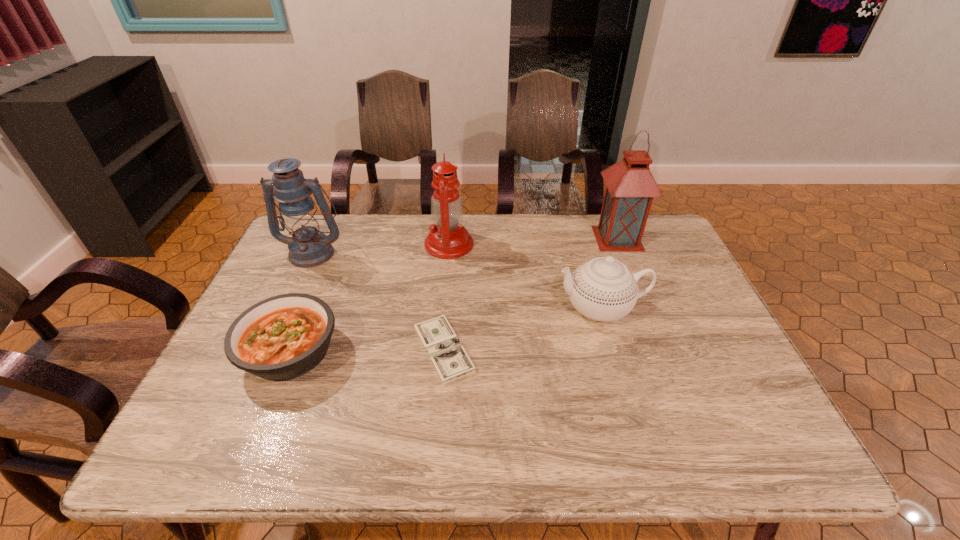
You are a GUI agent. You are given a task and a screenshot of the screen. Output one action in this format:
    pyautogui.click(x=<x>, y=<y>)
    Task: Click on the free space between the left lantern and the oil lamp
    
    Given the screenshot: What is the action you would take?
    pyautogui.click(x=381, y=248)

You are a GUI agent. You are given a task and a screenshot of the screen. Output one action in this format:
    pyautogui.click(x=<x>, y=<y>)
    Task: Click on the empty location between the fifth tallest object and the oil lamp
    
    Given the screenshot: What is the action you would take?
    pyautogui.click(x=370, y=298)

This screenshot has height=540, width=960. In order to click on free space that is in between the stew and the oil lamp in this screenshot , I will do `click(370, 298)`.

Locate an element on the screen. This screenshot has width=960, height=540. the fourth closest object relative to the right lantern is located at coordinates (283, 337).

Identify which object is the third nearest to the stew. Please provide its 2D coordinates. Your answer should be formatted as a tuple, i.e. [(x, y)], where the tuple contains the x and y coordinates of a point satisfying the conditions above.

[(448, 239)]

The image size is (960, 540). I want to click on vacant region that satisfies the following two spatial constraints: 1. on the front-facing side of the second shortest object; 2. on the left side of the left lantern, so click(266, 352).